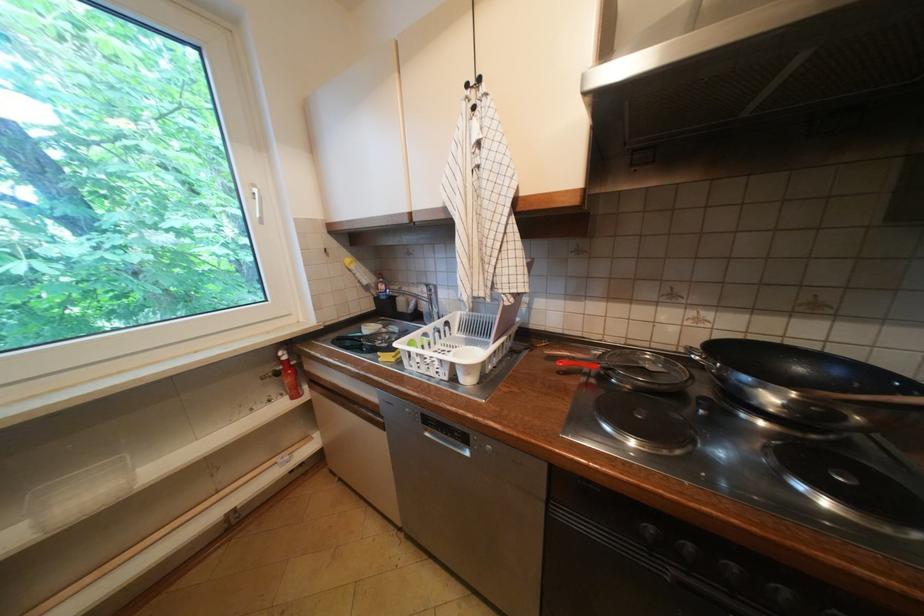
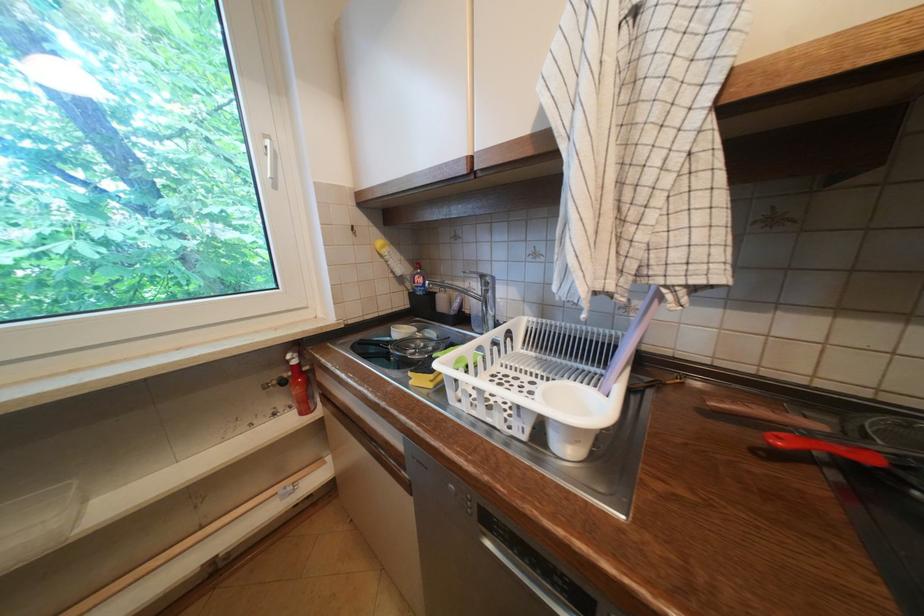
Locate, in the second image, the point that corresponds to point 388,361 in the first image.

(419, 383)